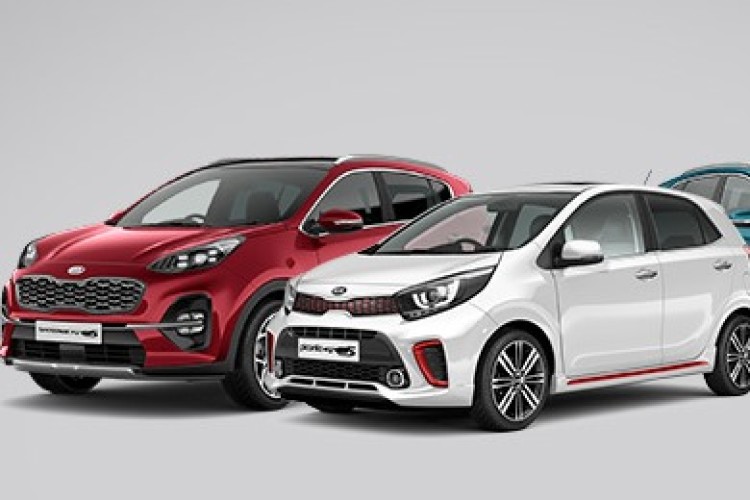
This screenshot has width=750, height=500. In order to click on floor in this screenshot , I will do `click(285, 484)`.